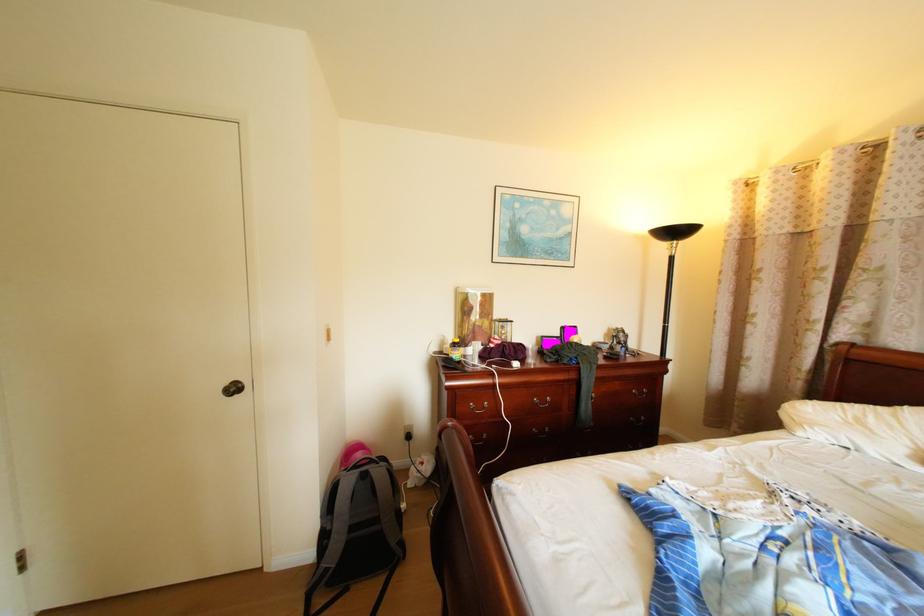
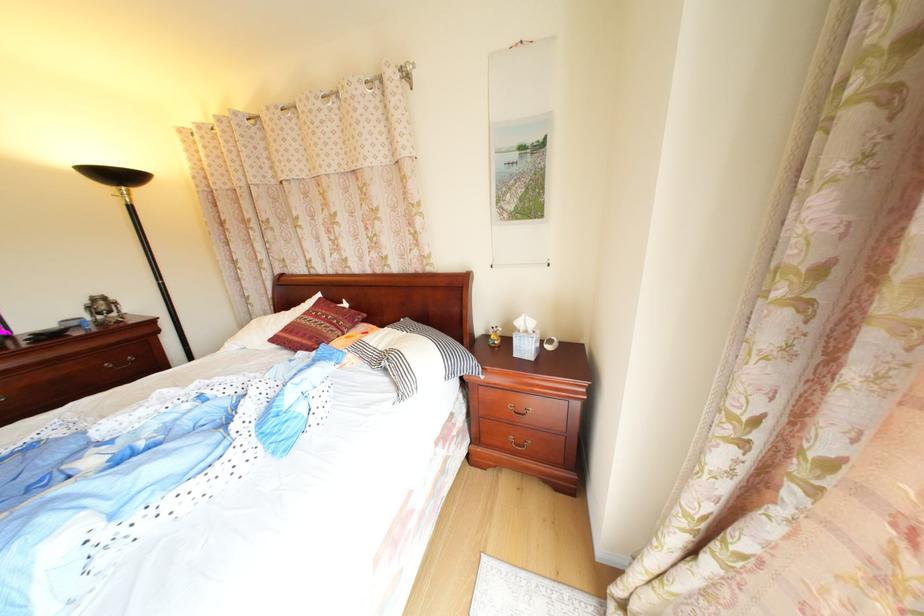
Where in the second image is the point corresponding to point (637, 333) from the first image?

(116, 301)